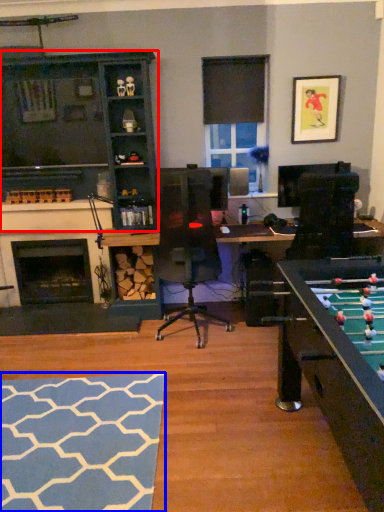
Question: Which object appears farthest to the camera in this image, cabinetry (highlighted by a red box) or flat (highlighted by a blue box)?

Choices:
 (A) cabinetry
 (B) flat

Answer: (A)